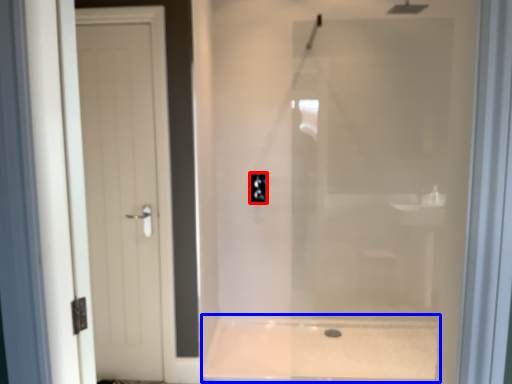
Question: Which object is further to the camera taking this photo, electric outlet (highlighted by a red box) or bath (highlighted by a blue box)?

Choices:
 (A) electric outlet
 (B) bath

Answer: (A)